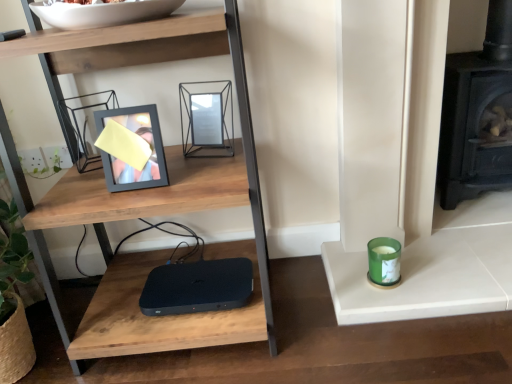
Question: Which direction should I rotate to face metallic geometric frame at upper center, acting as the 1th picture frame starting from the right, — up or down?

Choices:
 (A) up
 (B) down

Answer: (A)

Question: Is metallic geometric frame at upper center, acting as the 1th picture frame starting from the right, completely or partially inside green glass candle at right?

Choices:
 (A) yes
 (B) no

Answer: (B)

Question: Is green glass candle at right wider than metallic geometric frame at upper center, acting as the 1th picture frame starting from the right?

Choices:
 (A) yes
 (B) no

Answer: (B)

Question: Is green glass candle at right smaller than metallic geometric frame at upper center, acting as the 1th picture frame starting from the right?

Choices:
 (A) yes
 (B) no

Answer: (A)

Question: Does green glass candle at right have a larger size compared to metallic geometric frame at upper center, which is the 2th picture frame in left-to-right order?

Choices:
 (A) yes
 (B) no

Answer: (B)

Question: Can you confirm if green glass candle at right is thinner than metallic geometric frame at upper center, acting as the 1th picture frame starting from the right?

Choices:
 (A) yes
 (B) no

Answer: (A)

Question: Considering the relative sizes of green glass candle at right and metallic geometric frame at upper center, which is the 2th picture frame in left-to-right order, in the image provided, is green glass candle at right shorter than metallic geometric frame at upper center, which is the 2th picture frame in left-to-right order,?

Choices:
 (A) yes
 (B) no

Answer: (A)

Question: From the image's perspective, does matte black picture frame at upper left, which appears as the second picture frame when viewed from the right, appear higher than metallic geometric frame at upper center, acting as the 1th picture frame starting from the right?

Choices:
 (A) no
 (B) yes

Answer: (A)

Question: Is matte black picture frame at upper left, marked as the first picture frame in a left-to-right arrangement, in contact with metallic geometric frame at upper center, which is the 2th picture frame in left-to-right order?

Choices:
 (A) yes
 (B) no

Answer: (B)

Question: Does matte black picture frame at upper left, marked as the first picture frame in a left-to-right arrangement, have a greater height compared to metallic geometric frame at upper center, acting as the 1th picture frame starting from the right?

Choices:
 (A) no
 (B) yes

Answer: (B)

Question: Is matte black picture frame at upper left, marked as the first picture frame in a left-to-right arrangement, looking in the opposite direction of metallic geometric frame at upper center, acting as the 1th picture frame starting from the right?

Choices:
 (A) yes
 (B) no

Answer: (B)

Question: Is matte black picture frame at upper left, marked as the first picture frame in a left-to-right arrangement, facing towards metallic geometric frame at upper center, which is the 2th picture frame in left-to-right order?

Choices:
 (A) yes
 (B) no

Answer: (B)

Question: Considering the relative sizes of matte black picture frame at upper left, marked as the first picture frame in a left-to-right arrangement, and metallic geometric frame at upper center, which is the 2th picture frame in left-to-right order, in the image provided, is matte black picture frame at upper left, marked as the first picture frame in a left-to-right arrangement, smaller than metallic geometric frame at upper center, which is the 2th picture frame in left-to-right order,?

Choices:
 (A) yes
 (B) no

Answer: (B)

Question: Is black cast iron fireplace at right closer to the viewer compared to white glossy bowl at upper center?

Choices:
 (A) yes
 (B) no

Answer: (B)